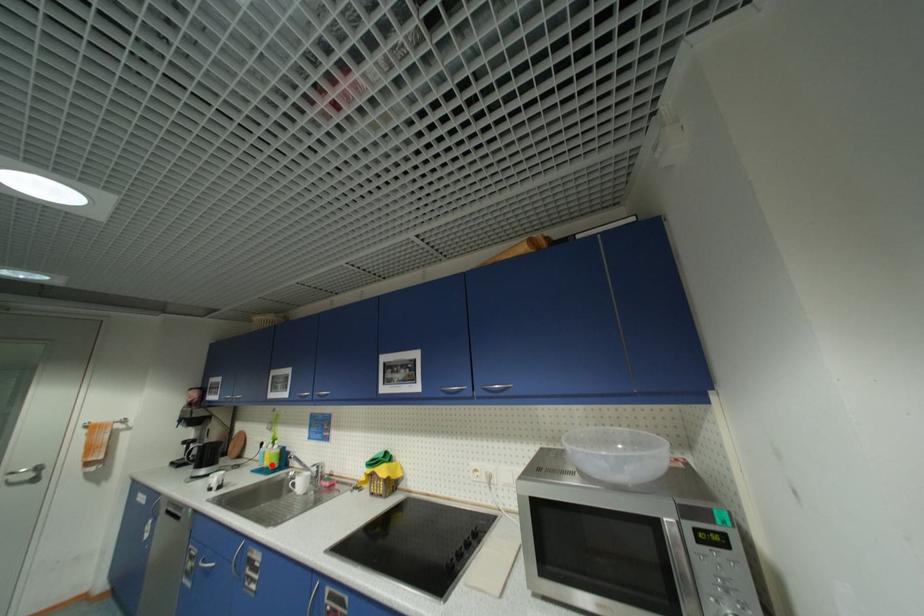
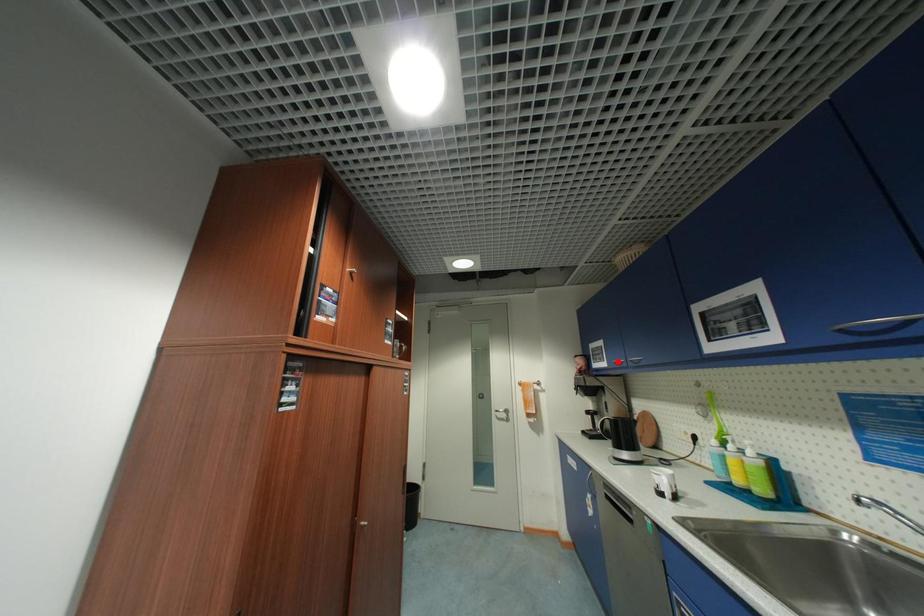
I am providing you with two images of the same scene from different viewpoints. A red point is marked on the first image and another point is marked on the second image. Do the highlighted points in image1 and image2 indicate the same real-world spot?

No